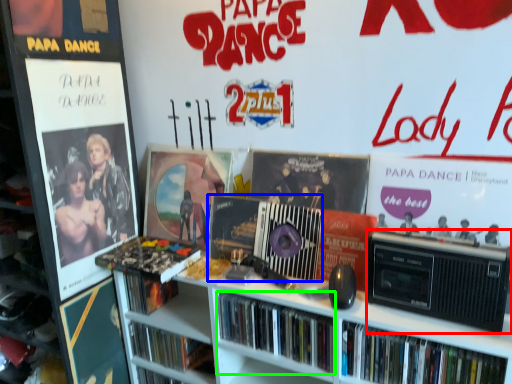
Question: Which object is the closest to the cassette (highlighted by a red box)? Choose among these: cassette (highlighted by a blue box) or book (highlighted by a green box).

Choices:
 (A) cassette
 (B) book

Answer: (B)